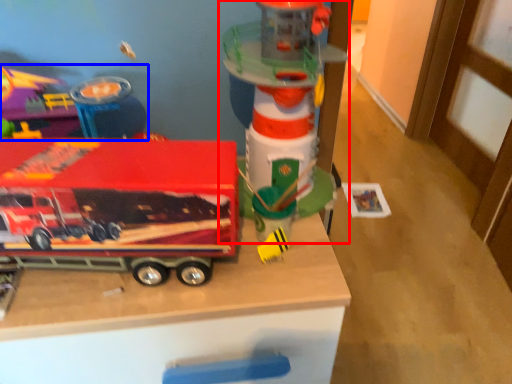
Question: Which object is further to the camera taking this photo, toy (highlighted by a red box) or toy (highlighted by a blue box)?

Choices:
 (A) toy
 (B) toy

Answer: (B)